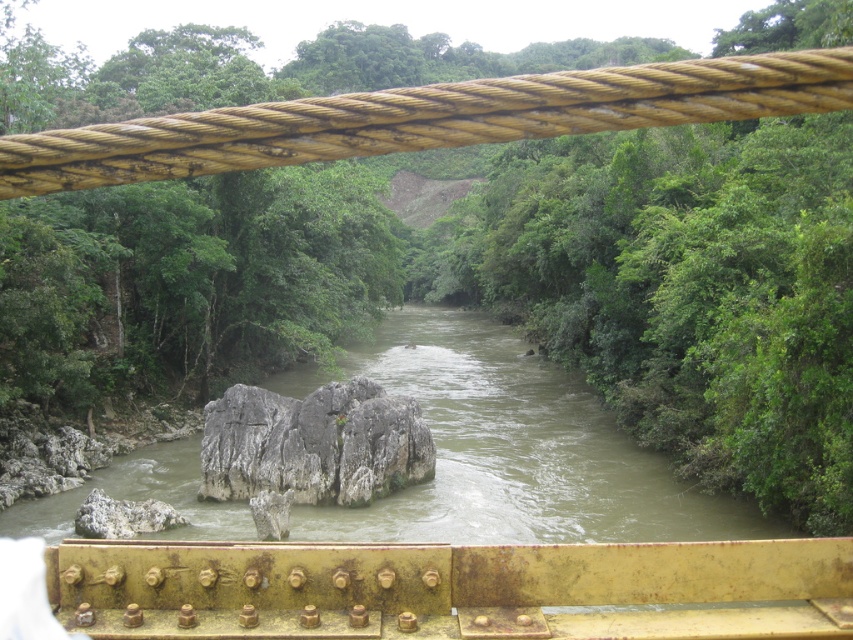
Question: Can you confirm if rusty yellow rope at upper center is positioned to the left of gray rough rock at center?

Choices:
 (A) no
 (B) yes

Answer: (A)

Question: Which object is the farthest from the brown muddy water at center?

Choices:
 (A) gray rough rock at center
 (B) rusty yellow rope at upper center

Answer: (A)

Question: Which point appears farthest from the camera in this image?

Choices:
 (A) (322, 120)
 (B) (387, 468)

Answer: (B)

Question: Is brown muddy water at center thinner than rusty yellow rope at upper center?

Choices:
 (A) yes
 (B) no

Answer: (A)

Question: Which point is closer to the camera taking this photo?

Choices:
 (A) (274, 419)
 (B) (735, 524)
 (C) (125, 144)

Answer: (C)

Question: Can you confirm if brown muddy water at center is positioned below rusty yellow rope at upper center?

Choices:
 (A) yes
 (B) no

Answer: (A)